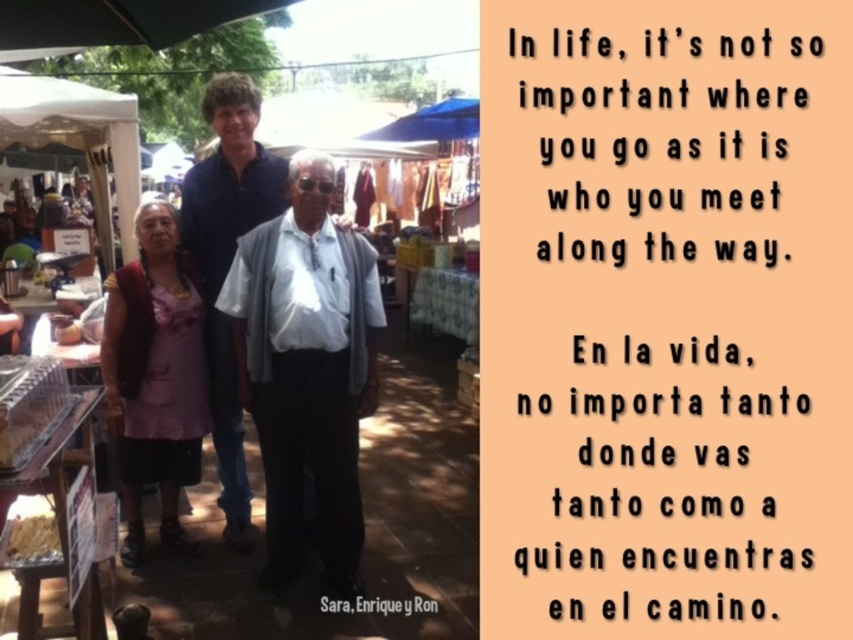
Question: Which point is closer to the camera?

Choices:
 (A) pink fabric vest at left
 (B) white matte shirt at center

Answer: (B)

Question: Is pink fabric vest at left closer to the viewer compared to blue cotton shirt at center?

Choices:
 (A) yes
 (B) no

Answer: (A)

Question: Can you confirm if white matte shirt at center is wider than blue cotton shirt at center?

Choices:
 (A) yes
 (B) no

Answer: (A)

Question: Which object appears farthest from the camera in this image?

Choices:
 (A) pink fabric vest at left
 (B) white matte shirt at center

Answer: (A)

Question: Is white matte shirt at center smaller than blue cotton shirt at center?

Choices:
 (A) yes
 (B) no

Answer: (A)

Question: Which of the following is the closest to the observer?

Choices:
 (A) (178, 467)
 (B) (308, 163)
 (C) (183, 218)

Answer: (B)